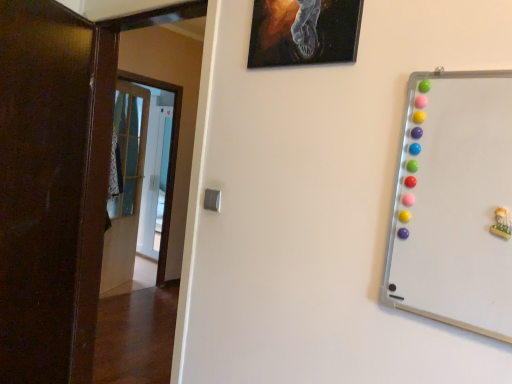
Question: In the image, is black canvas painting at upper center positioned in front of or behind whiteboard at right?

Choices:
 (A) front
 (B) behind

Answer: (B)

Question: Is point (303, 26) positioned closer to the camera than point (431, 299)?

Choices:
 (A) closer
 (B) farther

Answer: (B)

Question: Which of these objects is positioned farthest from the black canvas painting at upper center?

Choices:
 (A) transparent glass door at center
 (B) brown wooden door at left, which is the 2th door from front to back
 (C) whiteboard at right
 (D) dark wood door at left, the third door positioned from the back
 (E) wooden door at left, which appears as the 3th door when viewed from the front

Answer: (A)

Question: Which of these objects is positioned farthest from the dark wood door at left, the third door positioned from the back?

Choices:
 (A) brown wooden door at left, acting as the 2th door starting from the back
 (B) whiteboard at right
 (C) black canvas painting at upper center
 (D) wooden door at left, which appears as the 3th door when viewed from the front
 (E) transparent glass door at center

Answer: (E)